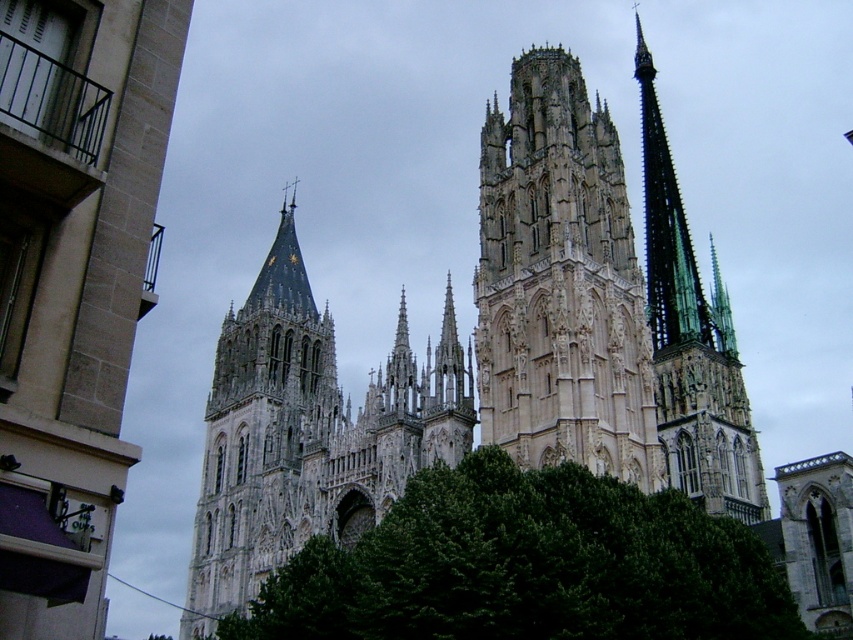
You are standing in front of the cathedral and want to take a photo that includes both the white stone church at center and the green leafy tree at center. Which one should you focus on to ensure both are in frame without needing to zoom in or out?

The white stone church at center is taller than the green leafy tree at center, so you should focus on the church to ensure both are in frame without needing to zoom in or out.

You are standing in front of the grand Gothic cathedral and notice a specific point marked at coordinates point (73,285). Based on the scene description, can you identify which architectural feature this point is located on?

The point (73,285) is located on the white stone church at center.

You are standing in front of the cathedral and notice two points marked on its facade. The first point is located at coordinates point (596, 321), and the second at point (699, 328). Which of these points is closer to you as you face the cathedral?

Point (596, 321) is in front of point (699, 328), so it is closer to you when facing the cathedral.